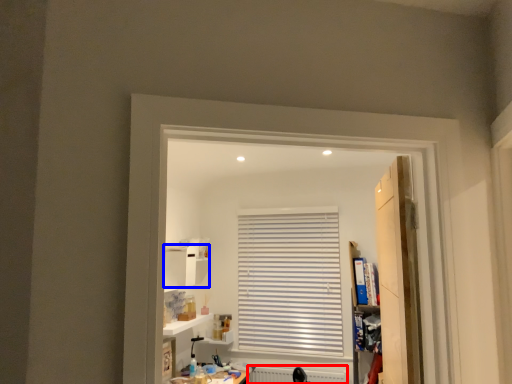
Question: Which of the following is the closest to the observer, radiator (highlighted by a red box) or cabinet (highlighted by a blue box)?

Choices:
 (A) radiator
 (B) cabinet

Answer: (B)